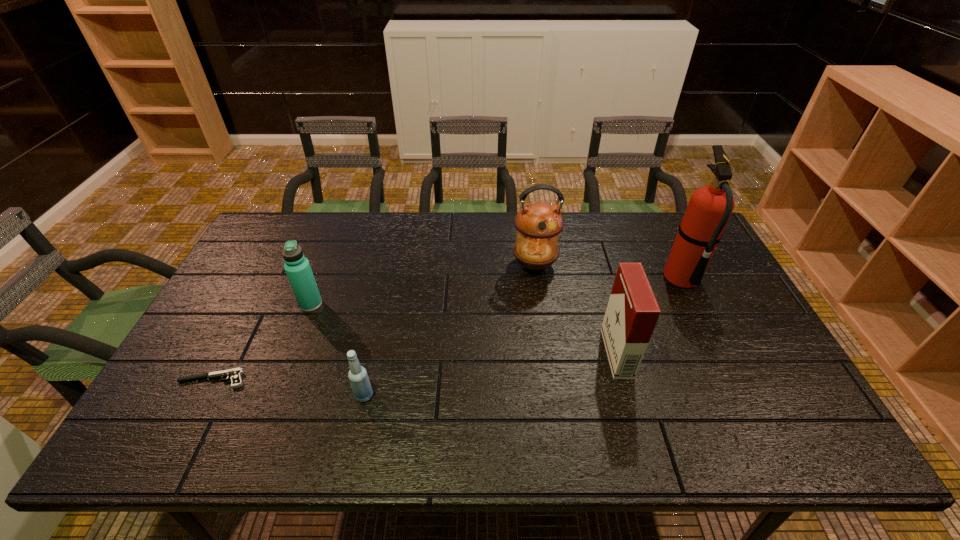
The height and width of the screenshot is (540, 960). I want to click on vacant area that lies between the fifth tallest object and the fifth object from right to left, so click(x=338, y=350).

I want to click on vacant space in between the fifth object from right to left and the shortest object, so click(x=262, y=342).

The image size is (960, 540). I want to click on empty space that is in between the leftmost object and the cigarette_case, so click(x=415, y=366).

Find the location of a particular element. free space between the pistol and the cigarette_case is located at coordinates (415, 366).

Where is `free space between the fourth object from left to right and the cigarette_case`? free space between the fourth object from left to right and the cigarette_case is located at coordinates (576, 309).

Select which object is the second closest to the cigarette_case. Please provide its 2D coordinates. Your answer should be formatted as a tuple, i.e. [(x, y)], where the tuple contains the x and y coordinates of a point satisfying the conditions above.

[(709, 208)]

Choose which object is the third nearest neighbor to the leftmost object. Please provide its 2D coordinates. Your answer should be formatted as a tuple, i.e. [(x, y)], where the tuple contains the x and y coordinates of a point satisfying the conditions above.

[(538, 224)]

Where is `vacant space that satisfies the following two spatial constraints: 1. on the front-facing side of the shortest object; 2. on the back side of the third object from left to right`? This screenshot has width=960, height=540. vacant space that satisfies the following two spatial constraints: 1. on the front-facing side of the shortest object; 2. on the back side of the third object from left to right is located at coordinates (204, 395).

This screenshot has width=960, height=540. In order to click on free region that satisfies the following two spatial constraints: 1. at the nozzle of the rightmost object; 2. on the front side of the fifth tallest object in this screenshot , I will do pos(739,395).

Locate an element on the screen. This screenshot has height=540, width=960. vacant space that satisfies the following two spatial constraints: 1. on the front-facing side of the second shortest object; 2. on the right side of the shortest object is located at coordinates (204, 395).